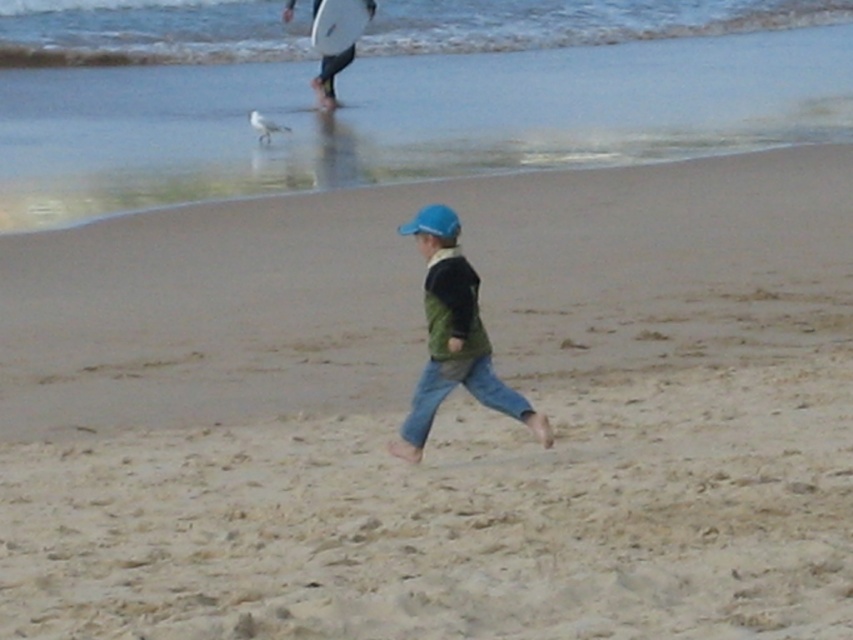
Is green matte jacket at center wider than white feathered gull at upper center?

Yes.

Can you confirm if green matte jacket at center is positioned below white feathered gull at upper center?

Correct, green matte jacket at center is located below white feathered gull at upper center.

Is point (422, 244) more distant than point (250, 124)?

No.

You are a GUI agent. You are given a task and a screenshot of the screen. Output one action in this format:
    pyautogui.click(x=<x>, y=<y>)
    Task: Click on the green matte jacket at center
    
    Given the screenshot: What is the action you would take?
    pyautogui.click(x=454, y=337)

Which of these two, white glossy surfboard at upper center or blue matte baseball hat at center, stands taller?

With more height is white glossy surfboard at upper center.

What do you see at coordinates (338, 24) in the screenshot?
I see `white glossy surfboard at upper center` at bounding box center [338, 24].

Is point (326, 22) closer to viewer compared to point (410, 228)?

No.

You are a GUI agent. You are given a task and a screenshot of the screen. Output one action in this format:
    pyautogui.click(x=<x>, y=<y>)
    Task: Click on the white glossy surfboard at upper center
    The image size is (853, 640).
    Given the screenshot: What is the action you would take?
    pyautogui.click(x=338, y=24)

Is white smooth water at upper center wider than white feathered gull at upper center?

Yes.

Can you confirm if white smooth water at upper center is bigger than white feathered gull at upper center?

Correct, white smooth water at upper center is larger in size than white feathered gull at upper center.

Between point (300, 26) and point (265, 118), which one is positioned behind?

Point (300, 26)

Where is `white smooth water at upper center`? white smooth water at upper center is located at coordinates (576, 20).